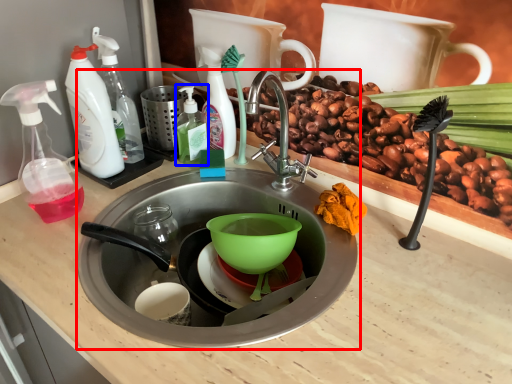
Question: Which of the following is the farthest to the observer, sink (highlighted by a red box) or bottle (highlighted by a blue box)?

Choices:
 (A) sink
 (B) bottle

Answer: (B)